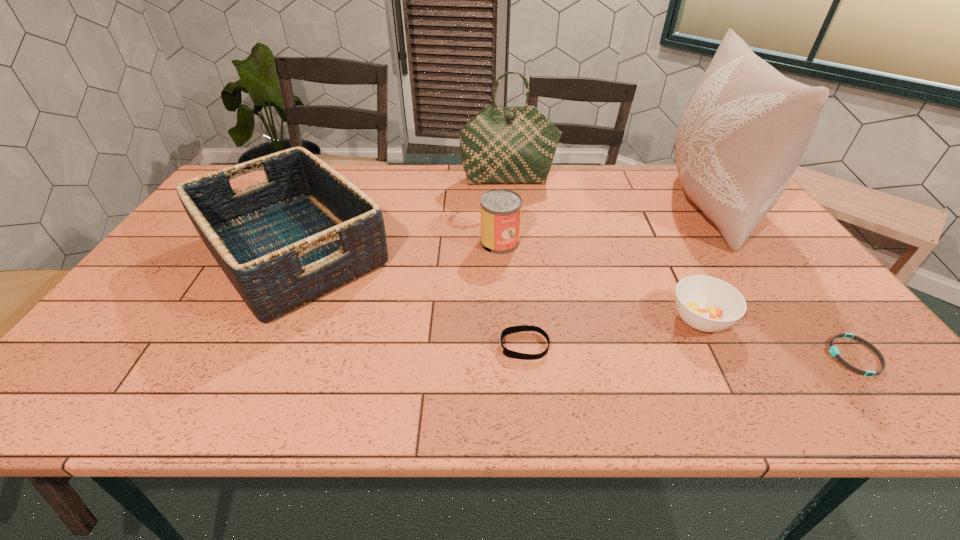
This screenshot has height=540, width=960. Identify the location of the tallest object. (745, 128).

Image resolution: width=960 pixels, height=540 pixels. In order to click on the sixth shortest object in this screenshot , I will do `click(500, 145)`.

The height and width of the screenshot is (540, 960). Identify the location of basket. (304, 231).

Where is `the leftmost object`? The width and height of the screenshot is (960, 540). the leftmost object is located at coordinates click(304, 231).

The width and height of the screenshot is (960, 540). What are the coordinates of `can` in the screenshot? It's located at (500, 209).

This screenshot has height=540, width=960. I want to click on the fifth tallest object, so click(708, 304).

Identify the location of the sixth tallest object. (514, 329).

Find the location of a particular element. This screenshot has height=540, width=960. the taller wristband is located at coordinates (514, 329).

Identify the location of the shorter wristband. This screenshot has height=540, width=960. (833, 350).

What are the coordinates of `the shortest object` in the screenshot? It's located at (833, 350).